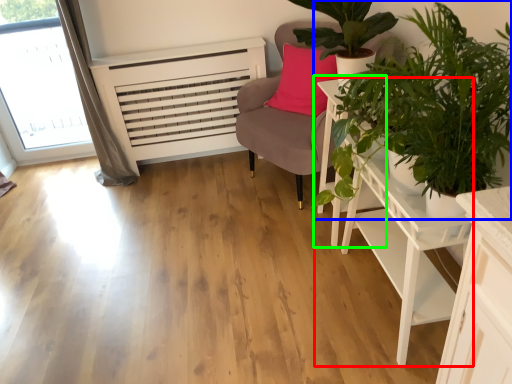
Question: Considering the real-world distances, which object is farthest from table (highlighted by a red box)? houseplant (highlighted by a blue box) or side table (highlighted by a green box)?

Choices:
 (A) houseplant
 (B) side table

Answer: (A)